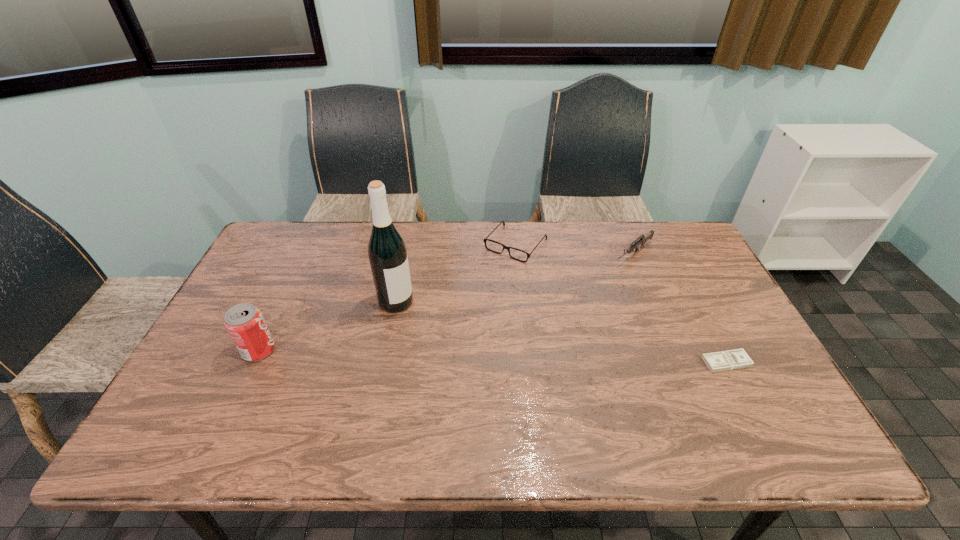
Identify the location of object that is the fourth nearest to the third nearest object. The height and width of the screenshot is (540, 960). (733, 359).

Locate which object ranks fourth in proximity to the third tallest object. Please provide its 2D coordinates. Your answer should be formatted as a tuple, i.e. [(x, y)], where the tuple contains the x and y coordinates of a point satisfying the conditions above.

[(245, 324)]

You are a GUI agent. You are given a task and a screenshot of the screen. Output one action in this format:
    pyautogui.click(x=<x>, y=<y>)
    Task: Click on the vacant area that satisfies the following two spatial constraints: 1. on the front side of the shortest object; 2. on the left side of the spectacles
    This screenshot has height=540, width=960.
    Given the screenshot: What is the action you would take?
    pyautogui.click(x=527, y=362)